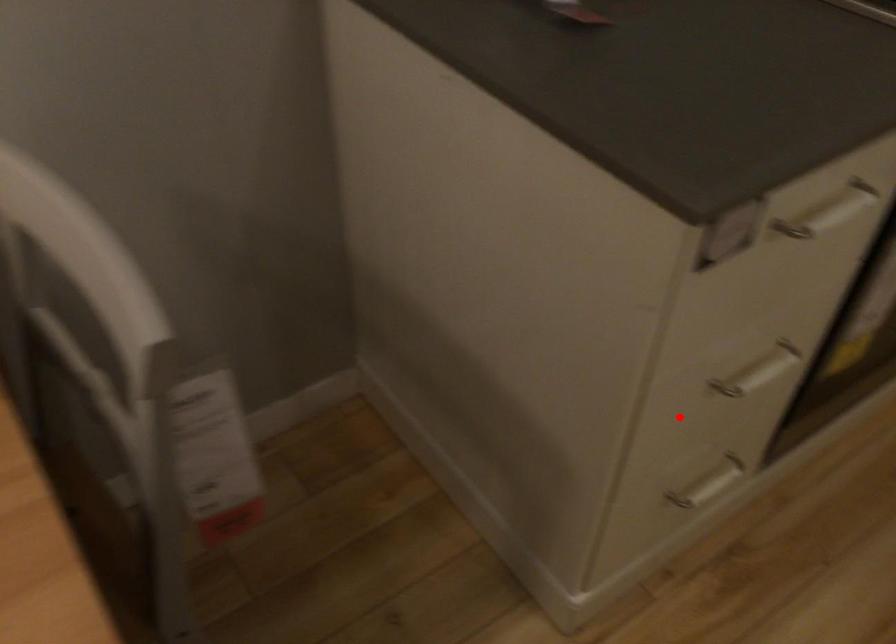
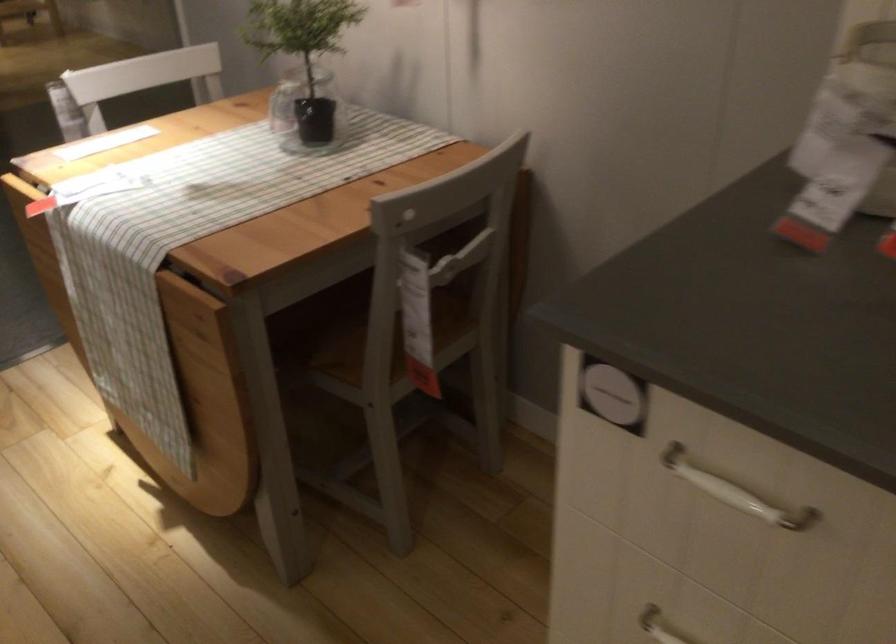
Locate, in the second image, the point that corresponds to the highlighted location in the first image.

(659, 626)